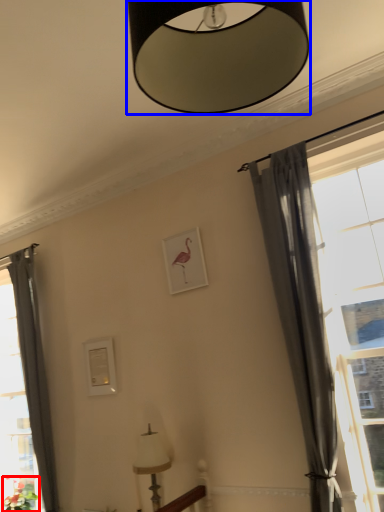
Question: Which object appears closest to the camera in this image, plant (highlighted by a red box) or lamp (highlighted by a blue box)?

Choices:
 (A) plant
 (B) lamp

Answer: (B)